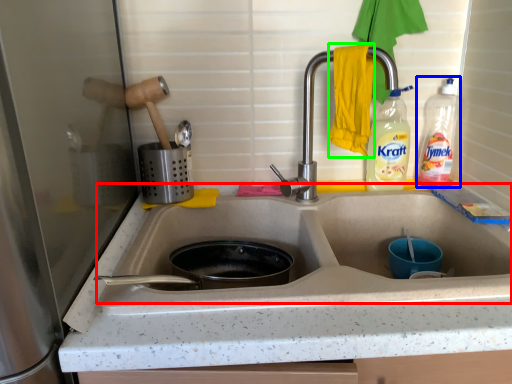
Question: Estimate the real-world distances between objects in this image. Which object is closer to sink (highlighted by a red box), bottle (highlighted by a blue box) or hand towel (highlighted by a green box)?

Choices:
 (A) bottle
 (B) hand towel

Answer: (B)